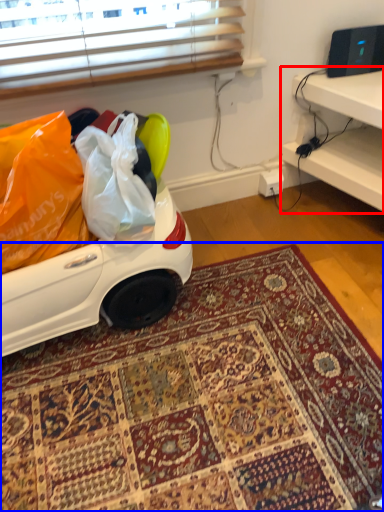
Question: Which point is closer to the camera, furniture (highlighted by a red box) or mat (highlighted by a blue box)?

Choices:
 (A) furniture
 (B) mat

Answer: (B)